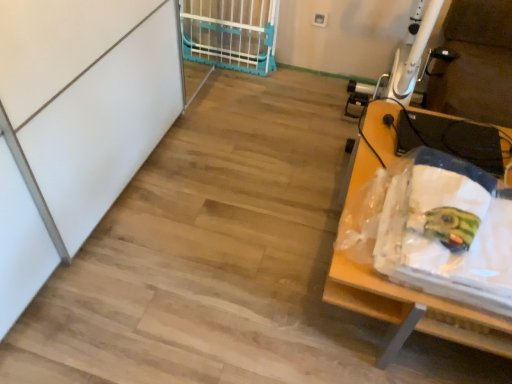
Question: Choose the correct answer: Is blue plastic gate at upper center inside wooden table at right or outside it?

Choices:
 (A) outside
 (B) inside

Answer: (A)

Question: From the image's perspective, is blue plastic gate at upper center located above or below wooden table at right?

Choices:
 (A) below
 (B) above

Answer: (B)

Question: From a real-world perspective, is blue plastic gate at upper center positioned above or below wooden table at right?

Choices:
 (A) above
 (B) below

Answer: (A)

Question: Which is correct: wooden table at right is inside blue plastic gate at upper center, or outside of it?

Choices:
 (A) outside
 (B) inside

Answer: (A)

Question: Based on their sizes in the image, would you say wooden table at right is bigger or smaller than blue plastic gate at upper center?

Choices:
 (A) small
 (B) big

Answer: (B)

Question: From a real-world perspective, is wooden table at right above or below blue plastic gate at upper center?

Choices:
 (A) above
 (B) below

Answer: (B)

Question: Considering the positions of point (393, 334) and point (205, 56), is point (393, 334) closer or farther from the camera than point (205, 56)?

Choices:
 (A) farther
 (B) closer

Answer: (B)